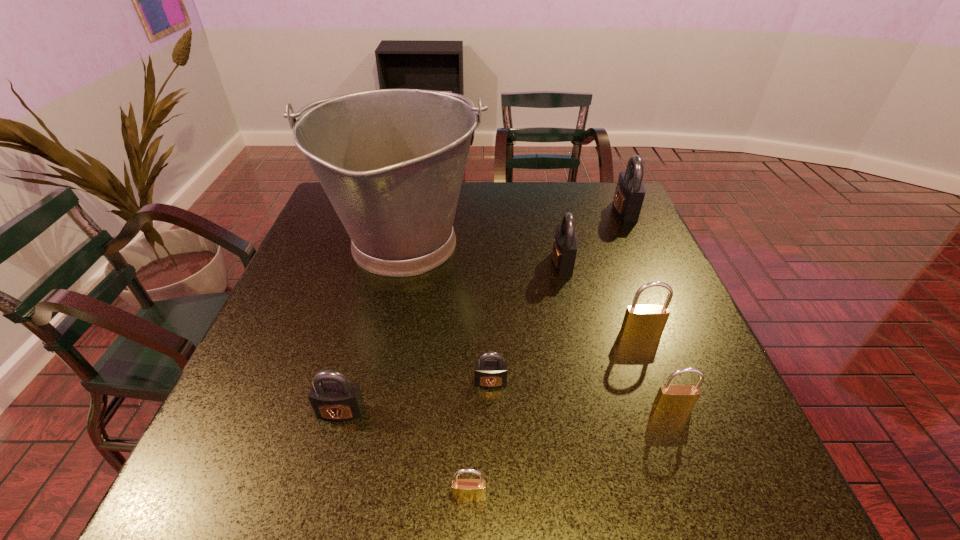
Locate an element on the screen. This screenshot has height=540, width=960. the tallest object is located at coordinates (391, 161).

Identify the location of the biggest gray padlock. This screenshot has width=960, height=540. (630, 190).

Where is `the farthest padlock`? Image resolution: width=960 pixels, height=540 pixels. the farthest padlock is located at coordinates [x=630, y=190].

This screenshot has width=960, height=540. In order to click on the sixth nearest padlock in this screenshot , I will do `click(565, 244)`.

This screenshot has height=540, width=960. In order to click on the fourth padlock from right to left in this screenshot , I will do `click(565, 244)`.

I want to click on the third farthest padlock, so click(x=639, y=320).

Locate an element on the screen. The width and height of the screenshot is (960, 540). the biggest brass padlock is located at coordinates (639, 320).

You are a GUI agent. You are given a task and a screenshot of the screen. Output one action in this format:
    pyautogui.click(x=<x>, y=<y>)
    Task: Click on the third biggest gray padlock
    This screenshot has width=960, height=540.
    Given the screenshot: What is the action you would take?
    pyautogui.click(x=339, y=400)

Locate an element on the screen. The width and height of the screenshot is (960, 540). the leftmost padlock is located at coordinates (339, 400).

Find the location of a particular element. Image resolution: width=960 pixels, height=540 pixels. the second nearest brass padlock is located at coordinates (670, 398).